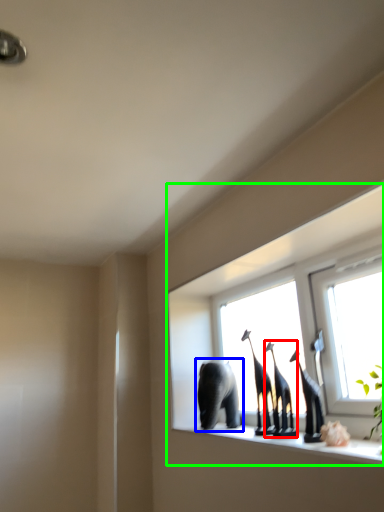
Question: Estimate the real-world distances between objects in this image. Which object is closer to animal (highlighted by a red box), elephant (highlighted by a blue box) or window (highlighted by a green box)?

Choices:
 (A) elephant
 (B) window

Answer: (A)